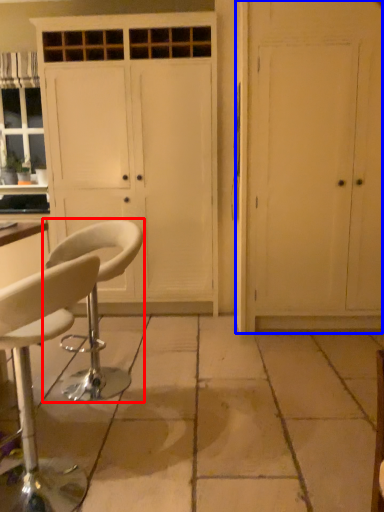
Question: Which point is further to the camera, chair (highlighted by a red box) or door (highlighted by a blue box)?

Choices:
 (A) chair
 (B) door

Answer: (B)